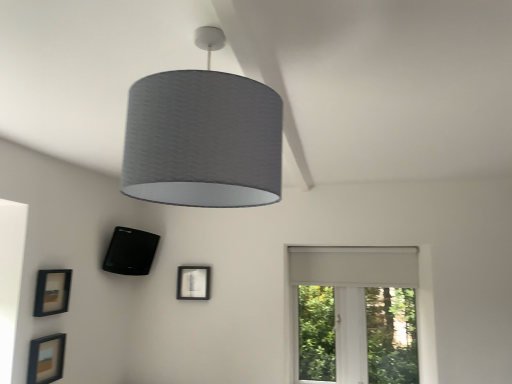
Question: Does black matte speaker at lower left, acting as the first picture frame starting from the right, appear on the right side of white matte window at right?

Choices:
 (A) no
 (B) yes

Answer: (A)

Question: From the image's perspective, is black matte speaker at lower left, arranged as the 3th picture frame when viewed from the left, below white matte window at right?

Choices:
 (A) yes
 (B) no

Answer: (B)

Question: Is black matte speaker at lower left, which ranks as the third picture frame in front-to-back order, to the left of white matte window at right from the viewer's perspective?

Choices:
 (A) yes
 (B) no

Answer: (A)

Question: Is there a large distance between black matte speaker at lower left, acting as the first picture frame starting from the right, and white matte window at right?

Choices:
 (A) yes
 (B) no

Answer: (A)

Question: Does black matte speaker at lower left, acting as the first picture frame starting from the right, have a greater width compared to white matte window at right?

Choices:
 (A) yes
 (B) no

Answer: (A)

Question: From the image's perspective, is matte black picture frame at lower left, the second picture frame positioned from the front, positioned above or below white matte window at right?

Choices:
 (A) above
 (B) below

Answer: (A)

Question: In terms of height, does matte black picture frame at lower left, placed as the 2th picture frame when sorted from right to left, look taller or shorter compared to white matte window at right?

Choices:
 (A) tall
 (B) short

Answer: (B)

Question: Is matte black picture frame at lower left, the 2th picture frame positioned from the back, bigger or smaller than white matte window at right?

Choices:
 (A) small
 (B) big

Answer: (A)

Question: Is matte black picture frame at lower left, the 2th picture frame positioned from the back, spatially inside white matte window at right, or outside of it?

Choices:
 (A) outside
 (B) inside

Answer: (A)

Question: From a real-world perspective, is white matte window at right above or below matte black picture frame at lower left, arranged as the 1th picture frame when viewed from the front?

Choices:
 (A) above
 (B) below

Answer: (A)

Question: Would you say white matte window at right is inside or outside matte black picture frame at lower left, the 3th picture frame viewed from the back?

Choices:
 (A) outside
 (B) inside

Answer: (A)

Question: Considering the positions of point (336, 347) and point (47, 342), is point (336, 347) closer or farther from the camera than point (47, 342)?

Choices:
 (A) farther
 (B) closer

Answer: (A)

Question: Is white matte window at right wider or thinner than matte black picture frame at lower left, the 3th picture frame viewed from the back?

Choices:
 (A) thin
 (B) wide

Answer: (B)

Question: From the image's perspective, is matte black picture frame at lower left, which is the 1th picture frame in left-to-right order, located above or below black matte speaker at lower left, which ranks as the third picture frame in front-to-back order?

Choices:
 (A) below
 (B) above

Answer: (A)

Question: Relative to black matte speaker at lower left, the first picture frame viewed from the back, is matte black picture frame at lower left, the third picture frame from the right, in front or behind?

Choices:
 (A) behind
 (B) front

Answer: (B)